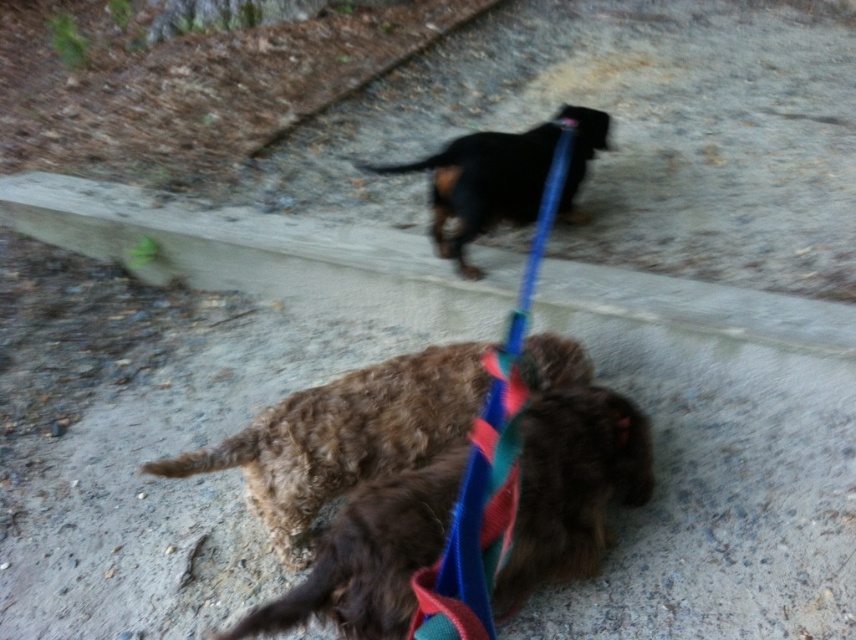
Who is taller, brown curly fur dog at center or black glossy dog at upper center?

black glossy dog at upper center is taller.

Based on the photo, which is more to the right, brown curly fur dog at center or black glossy dog at upper center?

black glossy dog at upper center

Between point (412, 611) and point (461, 216), which one is positioned behind?

The point (461, 216) is behind.

You are a GUI agent. You are given a task and a screenshot of the screen. Output one action in this format:
    pyautogui.click(x=<x>, y=<y>)
    Task: Click on the brown curly fur dog at center
    
    Given the screenshot: What is the action you would take?
    pyautogui.click(x=572, y=484)

Who is higher up, blue fabric leash at upper center or black glossy dog at upper center?

black glossy dog at upper center

Who is positioned more to the left, blue fabric leash at upper center or black glossy dog at upper center?

blue fabric leash at upper center

In order to click on blue fabric leash at upper center in this screenshot , I will do `click(488, 464)`.

Which of these two, brown curly fur dog at center or blue fabric leash at upper center, stands shorter?

brown curly fur dog at center

Does point (450, 465) come closer to viewer compared to point (429, 592)?

No, (450, 465) is behind (429, 592).

Describe the element at coordinates (572, 484) in the screenshot. The height and width of the screenshot is (640, 856). I see `brown curly fur dog at center` at that location.

Image resolution: width=856 pixels, height=640 pixels. I want to click on brown curly fur dog at center, so click(x=572, y=484).